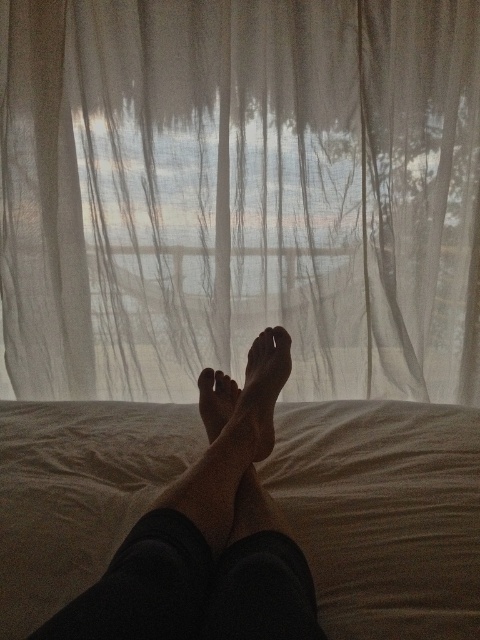
Between skinny bare feet at center and smooth skin foot at center, which one is positioned lower?

skinny bare feet at center is lower down.

Who is more forward, (182, 579) or (203, 397)?

Point (182, 579) is more forward.

At what (x,y) coordinates should I click in order to perform the action: click on skinny bare feet at center. Please return your answer as a coordinate pair (x, y). The image size is (480, 640). Looking at the image, I should click on (208, 536).

Does point (181, 16) lie behind point (263, 358)?

That is True.

Does translucent white curtain at center have a smaller size compared to smooth skin foot at center?

No.

This screenshot has width=480, height=640. Identify the location of translucent white curtain at center. (240, 195).

Which is more to the left, translucent white curtain at center or skinny bare feet at center?

skinny bare feet at center is more to the left.

Which of these two, translucent white curtain at center or skinny bare feet at center, stands shorter?

With less height is skinny bare feet at center.

At what (x,y) coordinates should I click in order to perform the action: click on translucent white curtain at center. Please return your answer as a coordinate pair (x, y). Looking at the image, I should click on (240, 195).

You are a GUI agent. You are given a task and a screenshot of the screen. Output one action in this format:
    pyautogui.click(x=<x>, y=<y>)
    Task: Click on the translucent white curtain at center
    Image resolution: width=480 pixels, height=640 pixels.
    Given the screenshot: What is the action you would take?
    pyautogui.click(x=240, y=195)